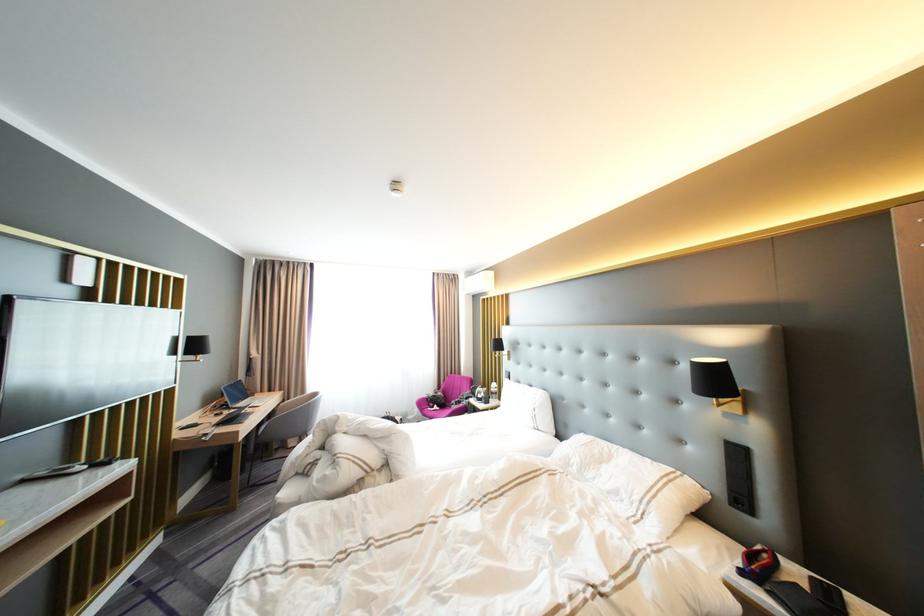
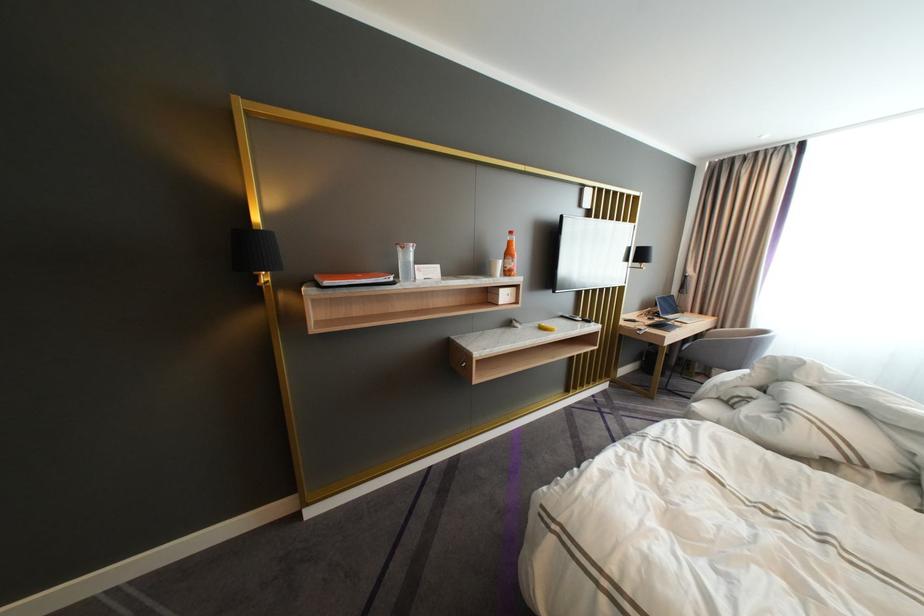
Where in the second image is the point corresponding to point (253, 405) from the first image?

(683, 317)